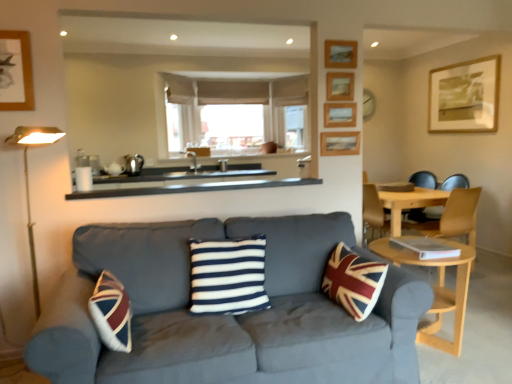
Question: From a real-world perspective, is light brown wooden chair at right positioned above or below light wood round table at lower right?

Choices:
 (A) above
 (B) below

Answer: (A)

Question: Does point (425, 235) appear closer or farther from the camera than point (444, 301)?

Choices:
 (A) closer
 (B) farther

Answer: (B)

Question: Estimate the real-world distances between objects in this image. Which object is farther from the wooden picture frame at upper center, arranged as the 4th picture frame when viewed from the front?

Choices:
 (A) light wood round table at lower right
 (B) white and navy striped cushion at center
 (C) wooden framed picture at upper right, which ranks as the 5th picture frame in front-to-back order
 (D) wooden picture frame at upper center, which is counted as the 3th picture frame, starting from the back
 (E) velvet blue couch at center

Answer: (C)

Question: Based on their relative distances, which object is nearer to the black matte counter top at center?

Choices:
 (A) wooden picture frame at upper center, arranged as the second picture frame when viewed from the left
 (B) white and navy striped cushion at center
 (C) wooden picture frame at upper right, marked as the 1th picture frame in a front-to-back arrangement
 (D) velvet blue couch at center
 (E) light wood round table at lower right

Answer: (A)